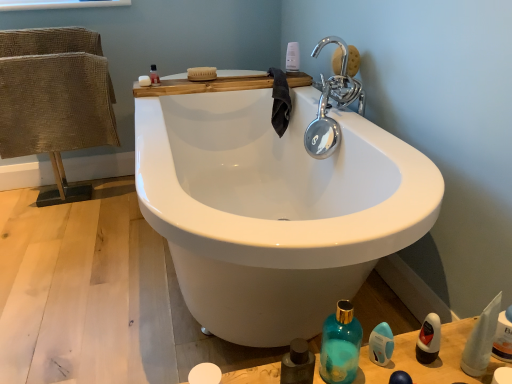
Locate an element on the screen. free spot to the right of blue glossy mouthwash at lower right, which is the 1th mouthwash in bottom-to-top order is located at coordinates coord(434,355).